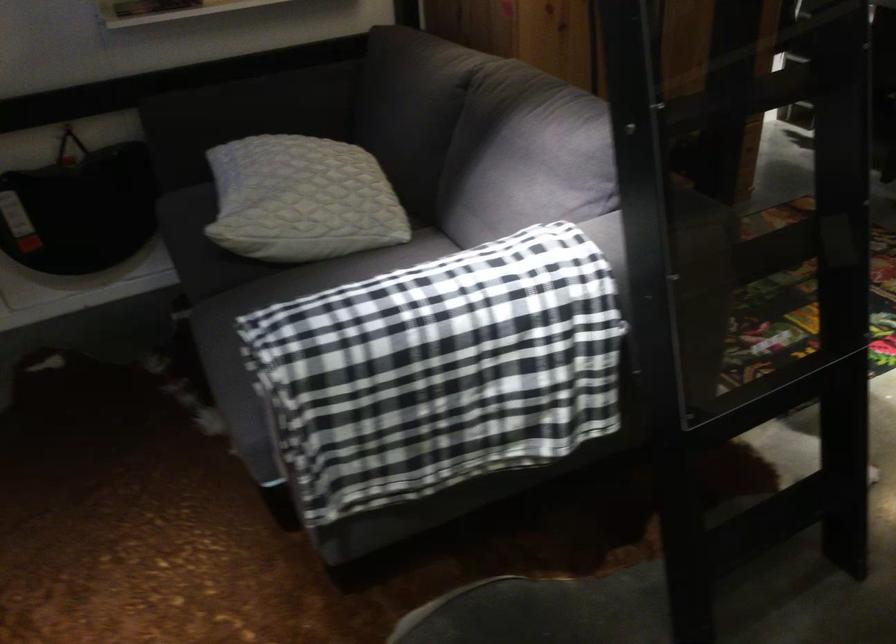
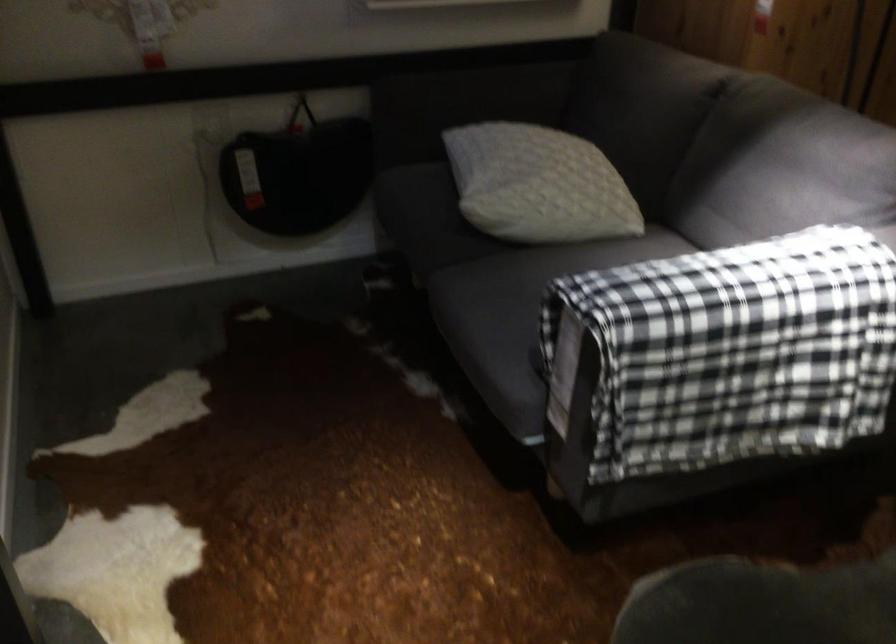
Where in the second image is the point corresponding to pixel 455 410 from the first image?

(745, 388)